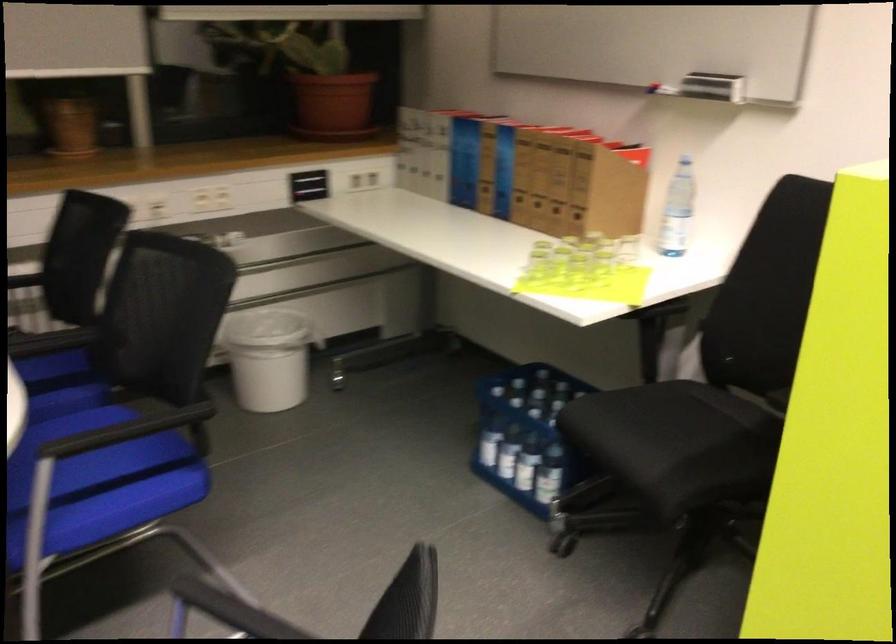
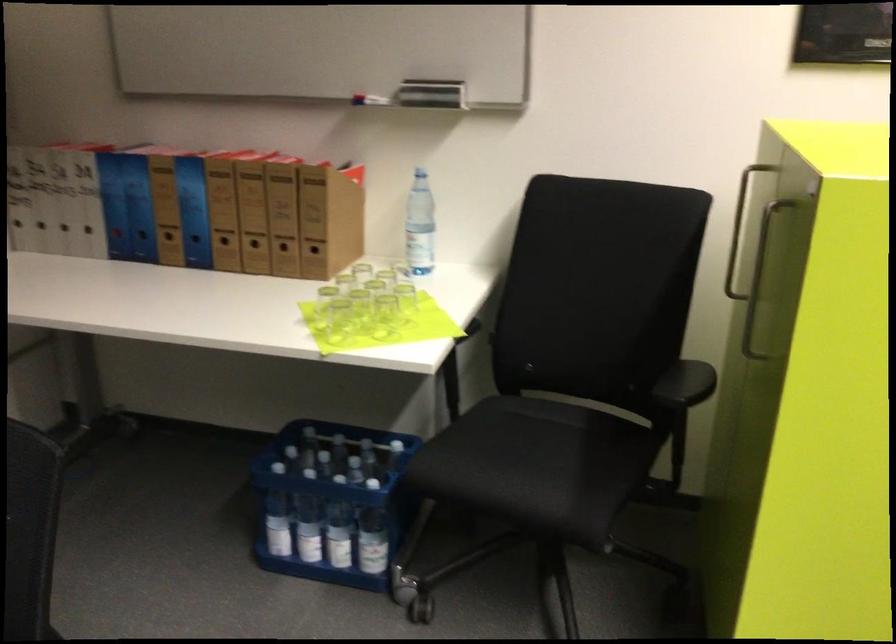
The point at (519, 202) is marked in the first image. Where is the corresponding point in the second image?

(225, 245)